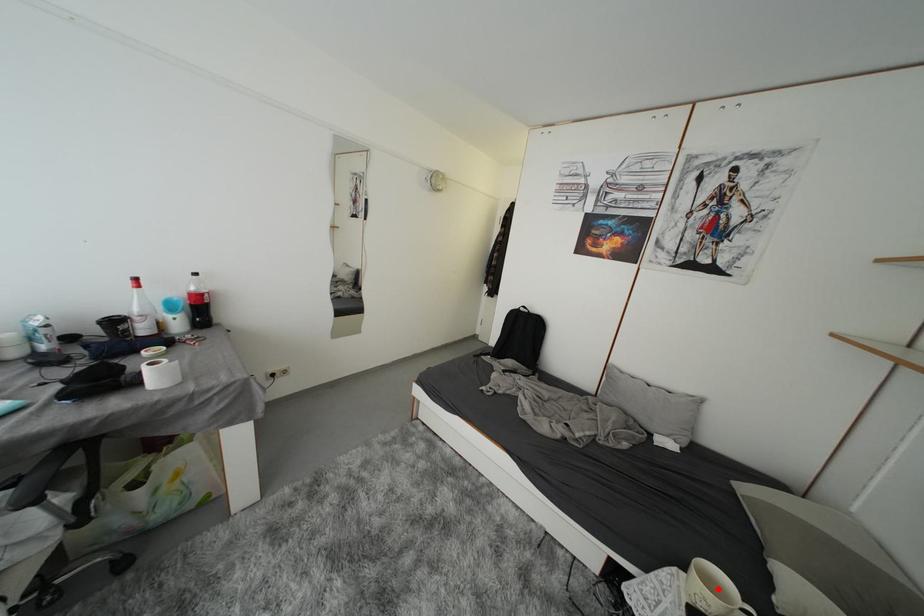
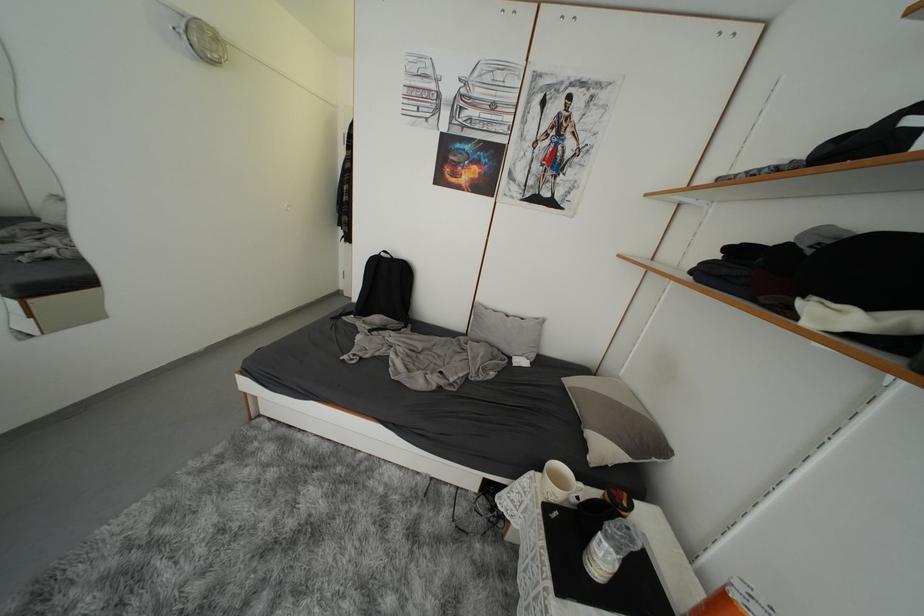
Question: I am providing you with two images of the same scene from different viewpoints. A red point is marked on the first image. Is the red point's position out of view in image 2?

Choices:
 (A) Yes
 (B) No

Answer: (B)